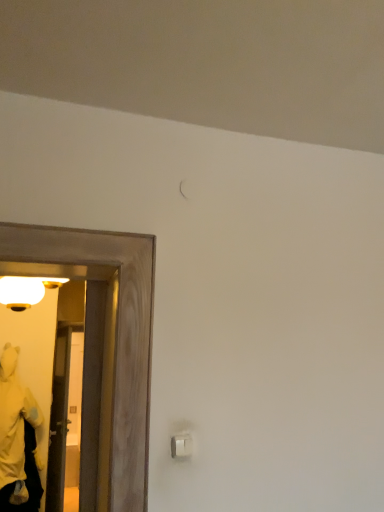
Question: Can you confirm if transparent glass door at left is positioned to the right of white plastic light switch at lower right?

Choices:
 (A) yes
 (B) no

Answer: (B)

Question: Is transparent glass door at left not inside white plastic light switch at lower right?

Choices:
 (A) yes
 (B) no

Answer: (A)

Question: Is transparent glass door at left thinner than white plastic light switch at lower right?

Choices:
 (A) no
 (B) yes

Answer: (A)

Question: Could you tell me if transparent glass door at left is turned towards white plastic light switch at lower right?

Choices:
 (A) no
 (B) yes

Answer: (B)

Question: Can you confirm if transparent glass door at left is wider than white plastic light switch at lower right?

Choices:
 (A) no
 (B) yes

Answer: (B)

Question: Is white plastic light switch at lower right at the back of transparent glass door at left?

Choices:
 (A) yes
 (B) no

Answer: (B)

Question: Can you confirm if transparent glass door at left is positioned to the left of yellow plush at left?

Choices:
 (A) no
 (B) yes

Answer: (A)

Question: Is transparent glass door at left located outside yellow plush at left?

Choices:
 (A) no
 (B) yes

Answer: (B)

Question: From a real-world perspective, is transparent glass door at left on top of yellow plush at left?

Choices:
 (A) yes
 (B) no

Answer: (B)

Question: Is there a large distance between transparent glass door at left and yellow plush at left?

Choices:
 (A) yes
 (B) no

Answer: (A)

Question: Does transparent glass door at left appear on the right side of yellow plush at left?

Choices:
 (A) no
 (B) yes

Answer: (B)

Question: Does transparent glass door at left have a smaller size compared to yellow plush at left?

Choices:
 (A) no
 (B) yes

Answer: (B)

Question: From the image's perspective, is white plastic light switch at lower right over wooden door at left?

Choices:
 (A) no
 (B) yes

Answer: (B)